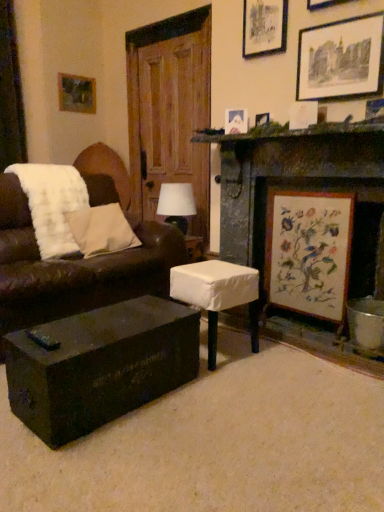
Image resolution: width=384 pixels, height=512 pixels. What are the coordinates of `free spot in front of white fabric-covered stool at center` in the screenshot? It's located at (235, 384).